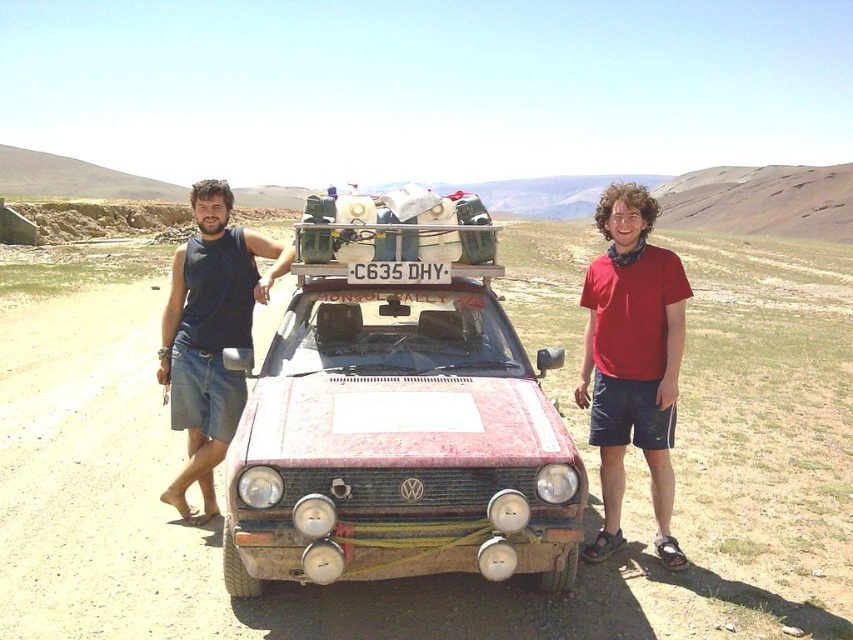
Question: Is red cotton shirt at center to the right of black cotton tank top at left from the viewer's perspective?

Choices:
 (A) no
 (B) yes

Answer: (B)

Question: Which of these objects is positioned farthest from the black cotton tank top at left?

Choices:
 (A) red cotton shirt at center
 (B) rusty metal car at center

Answer: (A)

Question: Considering the relative positions of rusty metal car at center and red cotton shirt at center in the image provided, where is rusty metal car at center located with respect to red cotton shirt at center?

Choices:
 (A) above
 (B) below

Answer: (B)

Question: Which of the following is the closest to the observer?

Choices:
 (A) (306, 474)
 (B) (192, 516)

Answer: (A)

Question: Is rusty metal car at center thinner than red cotton shirt at center?

Choices:
 (A) no
 (B) yes

Answer: (A)

Question: Which point is farther from the camera taking this photo?

Choices:
 (A) tap(219, 192)
 (B) tap(561, 480)
 (C) tap(624, 260)

Answer: (A)